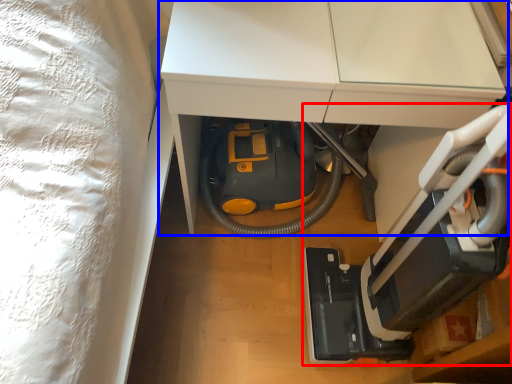
Question: Which object appears farthest to the camera in this image, equipment (highlighted by a red box) or furniture (highlighted by a blue box)?

Choices:
 (A) equipment
 (B) furniture

Answer: (B)